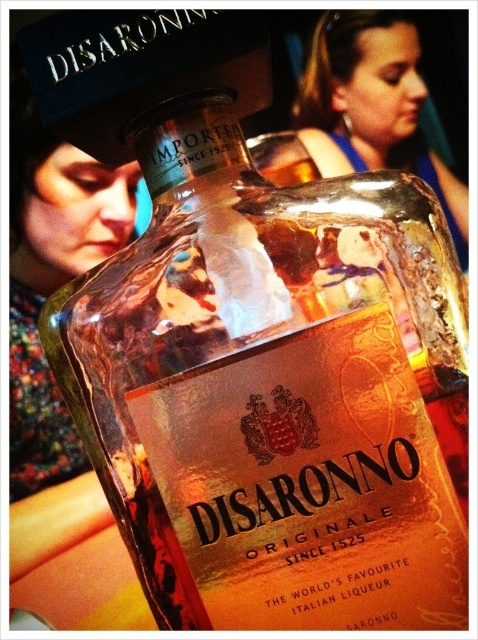
Question: Which object appears closest to the camera in this image?

Choices:
 (A) matte black hat at upper left
 (B) blue fabric hairband at upper center

Answer: (A)

Question: Can you confirm if matte black hat at upper left is smaller than blue fabric hairband at upper center?

Choices:
 (A) no
 (B) yes

Answer: (A)

Question: Which of the following is the closest to the observer?

Choices:
 (A) blue fabric hairband at upper center
 (B) matte black hat at upper left

Answer: (B)

Question: Does matte black hat at upper left lie behind blue fabric hairband at upper center?

Choices:
 (A) yes
 (B) no

Answer: (B)

Question: Can you confirm if matte black hat at upper left is positioned to the left of blue fabric hairband at upper center?

Choices:
 (A) no
 (B) yes

Answer: (B)

Question: Which object appears closest to the camera in this image?

Choices:
 (A) matte black hat at upper left
 (B) blue fabric hairband at upper center

Answer: (A)